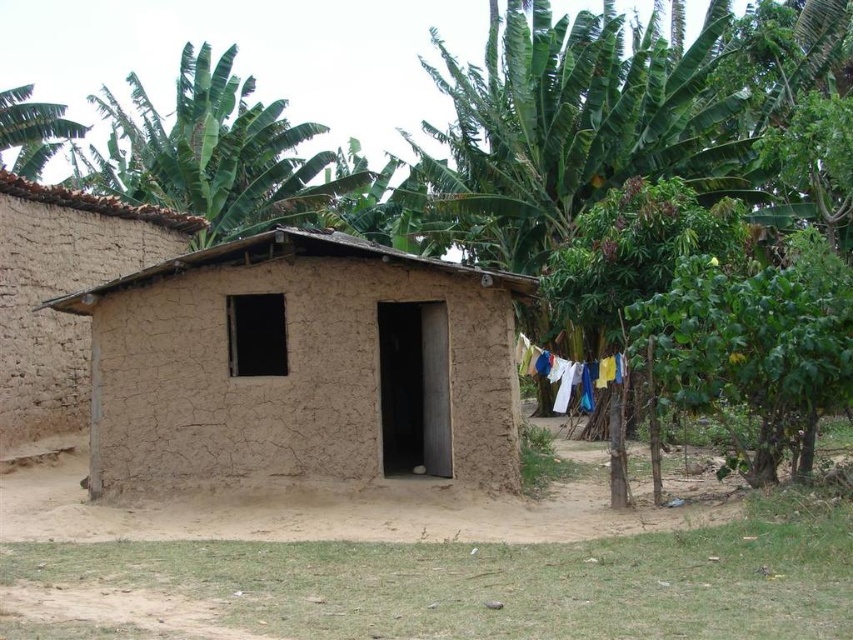
Question: Among these points, which one is farthest from the camera?

Choices:
 (A) (567, 381)
 (B) (409, 380)
 (C) (289, 216)
 (D) (0, 154)

Answer: (D)

Question: Does green leafy tree at upper left appear on the right side of white fabric at center?

Choices:
 (A) no
 (B) yes

Answer: (A)

Question: Which is nearer to the green leafy tree at upper left?

Choices:
 (A) brown mud hut at center
 (B) green leafy banana tree at upper left

Answer: (B)

Question: Which point is farther to the camera?

Choices:
 (A) (167, 300)
 (B) (4, 115)
 (C) (241, 129)

Answer: (C)

Question: Does green leafy banana tree at upper left have a lesser width compared to green leafy tree at upper left?

Choices:
 (A) yes
 (B) no

Answer: (B)

Question: Does green leafy banana tree at upper left appear on the left side of green leafy tree at upper left?

Choices:
 (A) yes
 (B) no

Answer: (B)